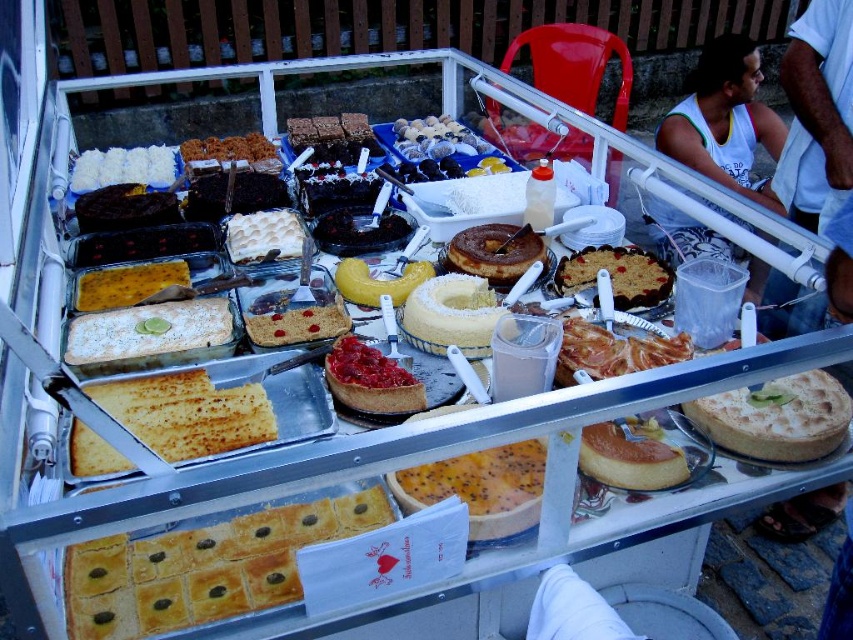
Does golden sponge cake at center have a greater width compared to glazed yellow cake at center?

In fact, golden sponge cake at center might be narrower than glazed yellow cake at center.

Does point (585, 426) come in front of point (271, 314)?

Yes, it is.

Is point (590, 467) closer to camera compared to point (328, 310)?

Yes, point (590, 467) is in front of point (328, 310).

You are a GUI agent. You are given a task and a screenshot of the screen. Output one action in this format:
    pyautogui.click(x=<x>, y=<y>)
    Task: Click on the golden sponge cake at center
    The width and height of the screenshot is (853, 640).
    Given the screenshot: What is the action you would take?
    pyautogui.click(x=630, y=458)

Identify the location of white crumbly cake at center. (149, 330).

Between white crumbly cake at center and golden brown cake at center, which one appears on the left side from the viewer's perspective?

white crumbly cake at center is more to the left.

The width and height of the screenshot is (853, 640). I want to click on white crumbly cake at center, so click(x=149, y=330).

Locate an element on the screen. Image resolution: width=853 pixels, height=640 pixels. white crumbly cake at center is located at coordinates (149, 330).

Does golden sponge cake at center have a smaller size compared to golden brown cake at center?

Yes, golden sponge cake at center is smaller than golden brown cake at center.

The height and width of the screenshot is (640, 853). What do you see at coordinates (630, 458) in the screenshot?
I see `golden sponge cake at center` at bounding box center [630, 458].

Where is `golden sponge cake at center`? golden sponge cake at center is located at coordinates (630, 458).